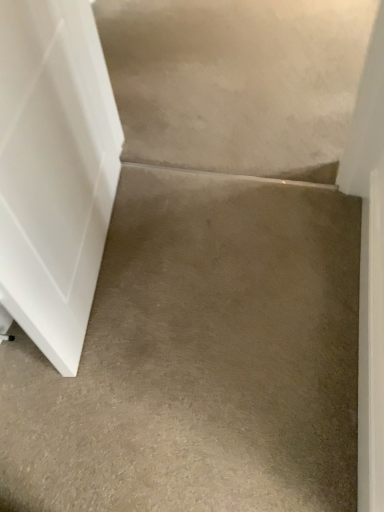
This screenshot has width=384, height=512. Describe the element at coordinates (54, 170) in the screenshot. I see `white matte door at left` at that location.

Where is `white matte door at left`? white matte door at left is located at coordinates (54, 170).

At what (x,y) coordinates should I click in order to perform the action: click on white matte door at left. Please return your answer as a coordinate pair (x, y). The width and height of the screenshot is (384, 512). Looking at the image, I should click on (54, 170).